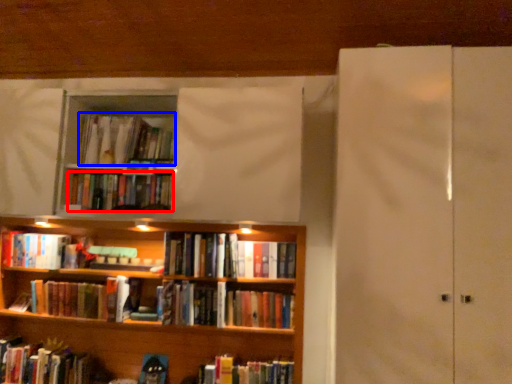
Question: Among these objects, which one is farthest to the camera, book (highlighted by a red box) or book (highlighted by a blue box)?

Choices:
 (A) book
 (B) book

Answer: (B)